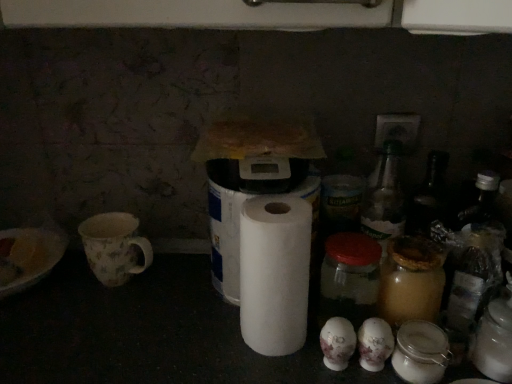
What is the approximate width of white paper at center?

The width of white paper at center is 4.32 inches.

Describe the element at coordinates (374, 344) in the screenshot. This screenshot has width=512, height=384. I see `white matte toilet paper at center, positioned as the third toilet paper in left-to-right order` at that location.

At what (x,y) coordinates should I click in order to perform the action: click on white matte toilet paper at center, the first toilet paper positioned from the left. Please return your answer as a coordinate pair (x, y). The image size is (512, 384). Looking at the image, I should click on (225, 239).

Between floral ceramic mug at left and white matte toilet paper at center, positioned as the third toilet paper in left-to-right order, which one appears on the right side from the viewer's perspective?

From the viewer's perspective, white matte toilet paper at center, positioned as the third toilet paper in left-to-right order, appears more on the right side.

Looking at this image, considering the relative sizes of floral ceramic mug at left and white matte toilet paper at center, the 1th toilet paper positioned from the right, in the image provided, is floral ceramic mug at left wider than white matte toilet paper at center, the 1th toilet paper positioned from the right,?

Yes.

Starting from the floral ceramic mug at left, which toilet paper is the 3rd one in front? Please provide its 2D coordinates.

[(374, 344)]

Considering the points (125, 272) and (382, 367), which point is in front, point (125, 272) or point (382, 367)?

The point (382, 367) is more forward.

Is transparent glass jar at center oriented away from white matte toilet paper at center, the third toilet paper positioned from the right?

transparent glass jar at center is not turned away from white matte toilet paper at center, the third toilet paper positioned from the right.

Considering the sizes of objects transparent glass jar at center and white matte toilet paper at center, the first toilet paper positioned from the left, in the image provided, who is shorter, transparent glass jar at center or white matte toilet paper at center, the first toilet paper positioned from the left,?

transparent glass jar at center is shorter.

Which object is thinner, transparent glass jar at center or white matte toilet paper at center, the third toilet paper positioned from the right?

transparent glass jar at center.

Could white matte toilet paper at center, the first toilet paper positioned from the left, be considered to be inside transparent glass jar at center?

No, white matte toilet paper at center, the first toilet paper positioned from the left, is not inside transparent glass jar at center.

Visually, is white matte toilet paper at center, the third toilet paper positioned from the right, positioned to the left or to the right of floral ceramic mug at left?

white matte toilet paper at center, the third toilet paper positioned from the right, is positioned on floral ceramic mug at left's right side.

Is the position of white matte toilet paper at center, the third toilet paper positioned from the right, more distant than that of floral ceramic mug at left?

No, white matte toilet paper at center, the third toilet paper positioned from the right, is in front of floral ceramic mug at left.

Could you tell me if white matte toilet paper at center, the third toilet paper positioned from the right, is turned towards floral ceramic mug at left?

No.

Which of these two, white matte toilet paper at center, the first toilet paper positioned from the left, or floral ceramic mug at left, is thinner?

With smaller width is floral ceramic mug at left.

Considering the sizes of objects white paper at center and transparent glass jar at center in the image provided, who is taller, white paper at center or transparent glass jar at center?

Standing taller between the two is white paper at center.

Is the surface of white paper at center in direct contact with transparent glass jar at center?

No, white paper at center is not next to transparent glass jar at center.

Find the location of `glass jar lying below the white paper at center (from the image's perspective)`. glass jar lying below the white paper at center (from the image's perspective) is located at coordinates (350, 277).

From the image's perspective, is white paper at center beneath transparent glass jar at center?

No, from the image's perspective, white paper at center is not below transparent glass jar at center.

From a real-world perspective, between floral ceramic mug at left and white matte toilet paper at lower center, acting as the second toilet paper starting from the left, who is vertically lower?

white matte toilet paper at lower center, acting as the second toilet paper starting from the left.

From the image's perspective, is floral ceramic mug at left located beneath white matte toilet paper at lower center, positioned as the second toilet paper in right-to-left order?

Incorrect, from the image's perspective, floral ceramic mug at left is higher than white matte toilet paper at lower center, positioned as the second toilet paper in right-to-left order.

Is white matte toilet paper at lower center, acting as the second toilet paper starting from the left, located within floral ceramic mug at left?

No, white matte toilet paper at lower center, acting as the second toilet paper starting from the left, is not a part of floral ceramic mug at left.

Between point (111, 273) and point (325, 339), which one is positioned behind?

The point (111, 273) is farther from the camera.

In terms of height, does white matte toilet paper at center, positioned as the third toilet paper in left-to-right order, look taller or shorter compared to white matte toilet paper at center, the first toilet paper positioned from the left?

Clearly, white matte toilet paper at center, positioned as the third toilet paper in left-to-right order, is shorter compared to white matte toilet paper at center, the first toilet paper positioned from the left.

Consider the image. Does white matte toilet paper at center, positioned as the third toilet paper in left-to-right order, turn towards white matte toilet paper at center, the first toilet paper positioned from the left?

No.

From a real-world perspective, who is located lower, white matte toilet paper at center, positioned as the third toilet paper in left-to-right order, or white matte toilet paper at center, the first toilet paper positioned from the left?

white matte toilet paper at center, positioned as the third toilet paper in left-to-right order, from a real-world perspective.

Where is `toilet paper positioned vertically above the white matte toilet paper at center, the 1th toilet paper positioned from the right (from a real-world perspective)`? This screenshot has height=384, width=512. toilet paper positioned vertically above the white matte toilet paper at center, the 1th toilet paper positioned from the right (from a real-world perspective) is located at coordinates (225, 239).

From the image's perspective, between white matte toilet paper at lower center, positioned as the second toilet paper in right-to-left order, and white matte toilet paper at center, the third toilet paper positioned from the right, who is located below?

white matte toilet paper at lower center, positioned as the second toilet paper in right-to-left order, is shown below in the image.

From a real-world perspective, is white matte toilet paper at lower center, positioned as the second toilet paper in right-to-left order, under white matte toilet paper at center, the first toilet paper positioned from the left?

Yes, from a real-world perspective, white matte toilet paper at lower center, positioned as the second toilet paper in right-to-left order, is under white matte toilet paper at center, the first toilet paper positioned from the left.

Which is more to the left, white matte toilet paper at lower center, positioned as the second toilet paper in right-to-left order, or white matte toilet paper at center, the third toilet paper positioned from the right?

Positioned to the left is white matte toilet paper at center, the third toilet paper positioned from the right.

From the picture: Between white matte toilet paper at lower center, positioned as the second toilet paper in right-to-left order, and white matte toilet paper at center, the third toilet paper positioned from the right, which one has smaller size?

Smaller between the two is white matte toilet paper at lower center, positioned as the second toilet paper in right-to-left order.

The height and width of the screenshot is (384, 512). Identify the location of the 3rd toilet paper in front when counting from the floral ceramic mug at left. click(x=374, y=344).

At what (x,y) coordinates should I click in order to perform the action: click on toilet paper that is above the transparent glass jar at center (from the image's perspective). Please return your answer as a coordinate pair (x, y). Looking at the image, I should click on (225, 239).

Estimate the real-world distances between objects in this image. Which object is closer to transparent glass jar at center, white matte toilet paper at center, the 1th toilet paper positioned from the right, or white matte toilet paper at center, the first toilet paper positioned from the left?

Among the two, white matte toilet paper at center, the 1th toilet paper positioned from the right, is located nearer to transparent glass jar at center.

Looking at the image, which one is located further to transparent glass jar at center, white matte toilet paper at lower center, positioned as the second toilet paper in right-to-left order, or white matte toilet paper at center, the third toilet paper positioned from the right?

white matte toilet paper at center, the third toilet paper positioned from the right, is positioned further to the anchor transparent glass jar at center.

Estimate the real-world distances between objects in this image. Which object is closer to transparent glass jar at center, floral ceramic mug at left or white paper at center?

white paper at center is positioned closer to the anchor transparent glass jar at center.

Which object lies nearer to the anchor point transparent glass jar at center, white matte toilet paper at lower center, positioned as the second toilet paper in right-to-left order, or floral ceramic mug at left?

white matte toilet paper at lower center, positioned as the second toilet paper in right-to-left order, is positioned closer to the anchor transparent glass jar at center.

Considering their positions, is white matte toilet paper at center, the 1th toilet paper positioned from the right, positioned further to white paper at center than white matte toilet paper at lower center, positioned as the second toilet paper in right-to-left order?

Based on the image, white matte toilet paper at center, the 1th toilet paper positioned from the right, appears to be further to white paper at center.

Which object lies nearer to the anchor point white matte toilet paper at lower center, acting as the second toilet paper starting from the left, floral ceramic mug at left or white matte toilet paper at center, the first toilet paper positioned from the left?

white matte toilet paper at center, the first toilet paper positioned from the left, is positioned closer to the anchor white matte toilet paper at lower center, acting as the second toilet paper starting from the left.

Looking at the image, which one is located further to white matte toilet paper at center, the third toilet paper positioned from the right, white matte toilet paper at center, the 1th toilet paper positioned from the right, or transparent glass jar at center?

Based on the image, white matte toilet paper at center, the 1th toilet paper positioned from the right, appears to be further to white matte toilet paper at center, the third toilet paper positioned from the right.

Looking at this image, based on their spatial positions, is transparent glass jar at center or floral ceramic mug at left further from white matte toilet paper at lower center, acting as the second toilet paper starting from the left?

Among the two, floral ceramic mug at left is located further to white matte toilet paper at lower center, acting as the second toilet paper starting from the left.

This screenshot has width=512, height=384. I want to click on paper towel between white matte toilet paper at center, the third toilet paper positioned from the right, and white matte toilet paper at center, positioned as the third toilet paper in left-to-right order, in the horizontal direction, so click(274, 273).

This screenshot has width=512, height=384. I want to click on paper towel situated between white matte toilet paper at center, the third toilet paper positioned from the right, and transparent glass jar at center from left to right, so coord(274,273).

Find the location of a particular element. glass jar between floral ceramic mug at left and white matte toilet paper at center, positioned as the third toilet paper in left-to-right order, from left to right is located at coordinates (350, 277).

You are a GUI agent. You are given a task and a screenshot of the screen. Output one action in this format:
    pyautogui.click(x=<x>, y=<y>)
    Task: Click on the paper towel located between floral ceramic mug at left and white matte toilet paper at lower center, acting as the second toilet paper starting from the left, in the left-right direction
    The width and height of the screenshot is (512, 384).
    Given the screenshot: What is the action you would take?
    pyautogui.click(x=274, y=273)